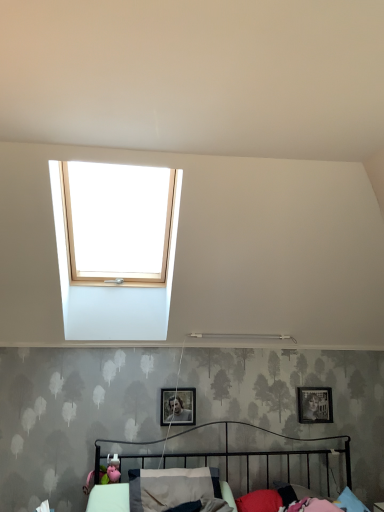
Question: From a real-world perspective, relative to red fabric pillow at lower center, the second pillow viewed from the left, is metallic black bed at lower center vertically above or below?

Choices:
 (A) below
 (B) above

Answer: (B)

Question: Relative to red fabric pillow at lower center, the 1th pillow viewed from the right, is metallic black bed at lower center in front or behind?

Choices:
 (A) behind
 (B) front

Answer: (B)

Question: Estimate the real-world distances between objects in this image. Which object is closer to the matte black picture frame at upper right, the second picture frame from the front?

Choices:
 (A) metallic silver picture frame at center, the 1th picture frame viewed from the front
 (B) metallic black bed at lower center
 (C) red fabric pillow at lower center, the 1th pillow viewed from the right
 (D) gray fabric pillow at lower center, the second pillow in the right-to-left sequence

Answer: (B)

Question: Estimate the real-world distances between objects in this image. Which object is farther from the red fabric pillow at lower center, the second pillow viewed from the left?

Choices:
 (A) gray fabric pillow at lower center, the second pillow in the right-to-left sequence
 (B) matte black picture frame at upper right, the second picture frame from the front
 (C) metallic black bed at lower center
 (D) metallic silver picture frame at center, arranged as the 2th picture frame when viewed from the back

Answer: (D)